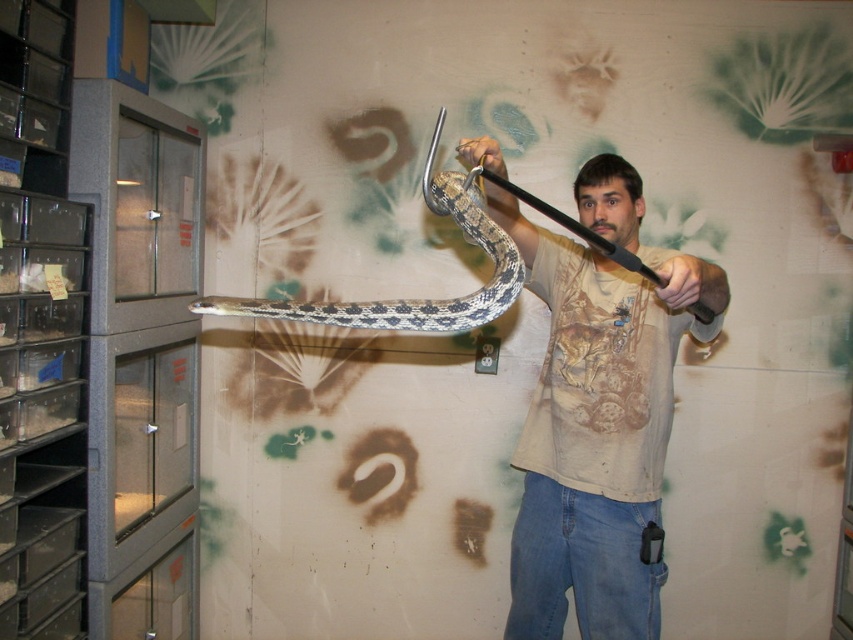
Question: Which of the following is the farthest from the observer?

Choices:
 (A) (500, 166)
 (B) (537, 595)

Answer: (B)

Question: Does patterned scales snake at center have a greater width compared to matte black snake at upper center?

Choices:
 (A) no
 (B) yes

Answer: (B)

Question: Which of the following is the closest to the observer?

Choices:
 (A) light brown cotton t-shirt at center
 (B) patterned scales snake at center

Answer: (B)

Question: Does patterned scales snake at center appear on the right side of matte black snake at upper center?

Choices:
 (A) no
 (B) yes

Answer: (A)

Question: Among these objects, which one is nearest to the camera?

Choices:
 (A) matte black snake at upper center
 (B) patterned scales snake at center
 (C) light brown cotton t-shirt at center

Answer: (B)

Question: Does patterned scales snake at center appear on the right side of matte black snake at upper center?

Choices:
 (A) yes
 (B) no

Answer: (B)